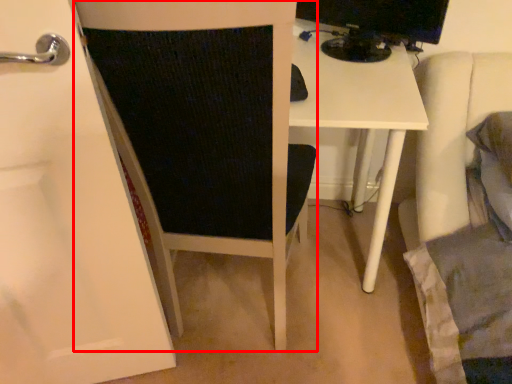
Question: Considering the relative positions of furniture (annotated by the red box) and desktop computer in the image provided, where is furniture (annotated by the red box) located with respect to the staircase?

Choices:
 (A) right
 (B) left

Answer: (B)